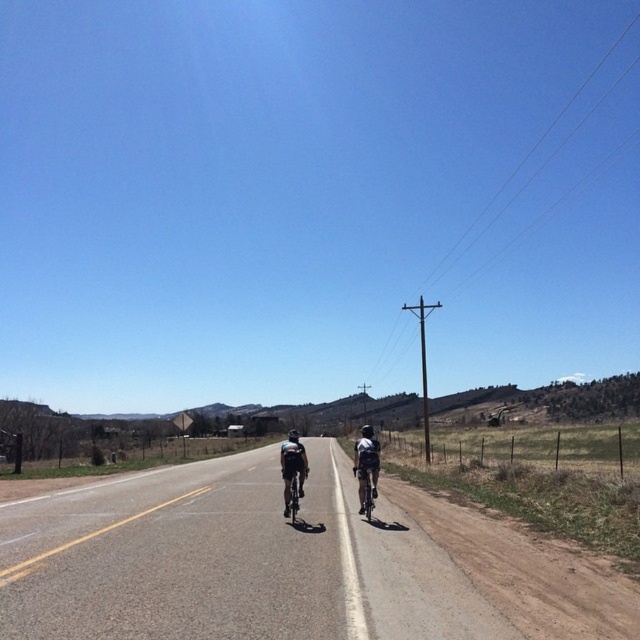
Between asphalt road at center and shiny metallic bicycle at center, which one appears on the left side from the viewer's perspective?

asphalt road at center

Which is below, asphalt road at center or shiny metallic bicycle at center?

asphalt road at center

I want to click on asphalt road at center, so click(289, 563).

Is point (368, 483) positioned behind point (291, 483)?

Yes, it is.

Between shiny silver bicycle at center and shiny metallic bicycle at center, which one appears on the left side from the viewer's perspective?

Positioned to the left is shiny metallic bicycle at center.

Who is more forward, (365, 516) or (298, 492)?

Point (298, 492) is in front.

Image resolution: width=640 pixels, height=640 pixels. In order to click on shiny silver bicycle at center in this screenshot , I will do `click(365, 486)`.

Does asphalt road at center have a smaller size compared to shiny silver bicycle at center?

No, asphalt road at center is not smaller than shiny silver bicycle at center.

Is asphalt road at center below shiny silver bicycle at center?

Correct, asphalt road at center is located below shiny silver bicycle at center.

Who is more distant from viewer, (81, 545) or (372, 496)?

Positioned behind is point (372, 496).

Where is `asphalt road at center`? Image resolution: width=640 pixels, height=640 pixels. asphalt road at center is located at coordinates (289, 563).